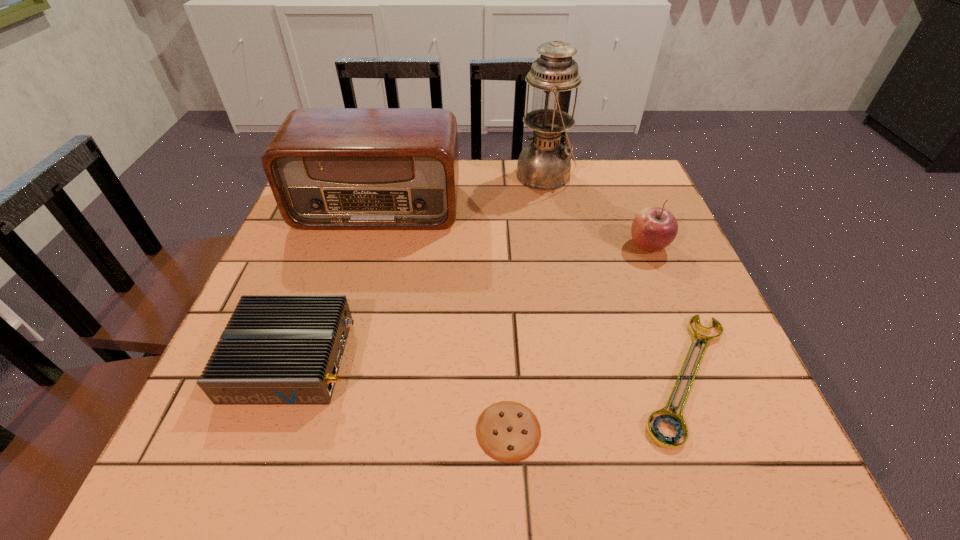
Where is `free space between the radio receiver and the fourth object from left to right`? free space between the radio receiver and the fourth object from left to right is located at coordinates (462, 191).

In order to click on vacant point located between the fourth nearest object and the third shortest object in this screenshot , I will do `click(469, 302)`.

The image size is (960, 540). Identify the location of vacant point located between the fourth object from left to right and the fourth object from right to left. (527, 303).

Locate an element on the screen. Image resolution: width=960 pixels, height=540 pixels. free space between the cookie and the second tallest object is located at coordinates 444,319.

The height and width of the screenshot is (540, 960). What are the coordinates of `free space between the cookie and the wrench` in the screenshot? It's located at (597, 403).

Where is `free spot between the fourth nearest object and the fourth object from left to right`? This screenshot has width=960, height=540. free spot between the fourth nearest object and the fourth object from left to right is located at coordinates (596, 211).

Where is `vacant region between the fourth tallest object and the wrench`? The image size is (960, 540). vacant region between the fourth tallest object and the wrench is located at coordinates (489, 367).

At what (x,y) coordinates should I click in order to perform the action: click on free space between the third object from right to left and the fourth tallest object. Please return your answer as a coordinate pair (x, y). This screenshot has width=960, height=540. Looking at the image, I should click on (418, 267).

Where is `unoccupied area between the router and the radio receiver`? unoccupied area between the router and the radio receiver is located at coordinates (335, 282).

Point out which object is positioned as the fifth nearest to the fourth nearest object. Please provide its 2D coordinates. Your answer should be formatted as a tuple, i.e. [(x, y)], where the tuple contains the x and y coordinates of a point satisfying the conditions above.

[(276, 349)]